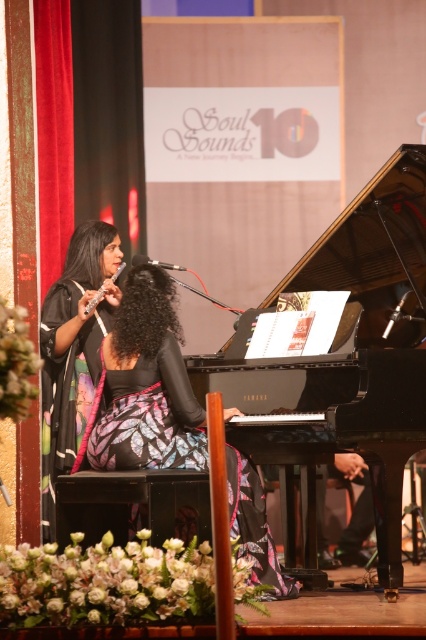
Is black polished piano at center shorter than floral dress at center?

No, black polished piano at center is not shorter than floral dress at center.

This screenshot has width=426, height=640. Describe the element at coordinates (347, 356) in the screenshot. I see `black polished piano at center` at that location.

You are a GUI agent. You are given a task and a screenshot of the screen. Output one action in this format:
    pyautogui.click(x=<x>, y=<y>)
    Task: Click on the black polished piano at center
    Image resolution: width=426 pixels, height=640 pixels.
    Given the screenshot: What is the action you would take?
    pyautogui.click(x=347, y=356)

Does floral dress at center appear under matte silver flute at center?

Yes.

Which is more to the right, floral dress at center or matte silver flute at center?

floral dress at center is more to the right.

Is point (92, 422) closer to camera compared to point (89, 304)?

Yes, it is.

Locate an element on the screen. This screenshot has width=426, height=640. floral dress at center is located at coordinates (146, 385).

Does floral dress at center lie behind black satin dress at left?

No, it is not.

Describe the element at coordinates (146, 385) in the screenshot. I see `floral dress at center` at that location.

Does point (123, 310) come farther from viewer compared to point (66, 467)?

No.

Locate an element on the screen. Image resolution: width=426 pixels, height=640 pixels. floral dress at center is located at coordinates (146, 385).